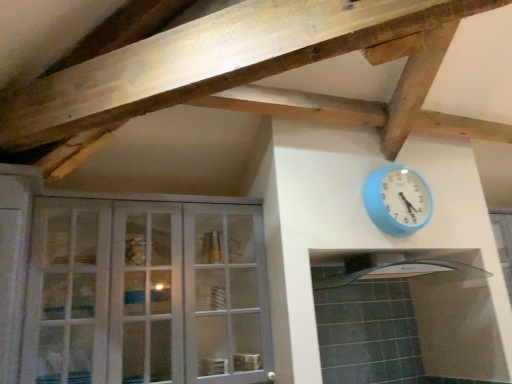
Question: Is white glass cabinet at left surrounding clear glass exhaust hood at center?

Choices:
 (A) yes
 (B) no

Answer: (B)

Question: From a real-world perspective, is white glass cabinet at left located higher than clear glass exhaust hood at center?

Choices:
 (A) yes
 (B) no

Answer: (B)

Question: Does white glass cabinet at left appear on the left side of clear glass exhaust hood at center?

Choices:
 (A) yes
 (B) no

Answer: (A)

Question: Considering the relative sizes of white glass cabinet at left and clear glass exhaust hood at center in the image provided, is white glass cabinet at left shorter than clear glass exhaust hood at center?

Choices:
 (A) no
 (B) yes

Answer: (A)

Question: Does white glass cabinet at left have a greater width compared to clear glass exhaust hood at center?

Choices:
 (A) yes
 (B) no

Answer: (B)

Question: Can you confirm if white glass cabinet at left is smaller than clear glass exhaust hood at center?

Choices:
 (A) yes
 (B) no

Answer: (B)

Question: Does blue plastic wall clock at upper right lie in front of clear glass exhaust hood at center?

Choices:
 (A) no
 (B) yes

Answer: (A)

Question: Can you confirm if blue plastic wall clock at upper right is thinner than clear glass exhaust hood at center?

Choices:
 (A) no
 (B) yes

Answer: (B)

Question: Is blue plastic wall clock at upper right at the left side of clear glass exhaust hood at center?

Choices:
 (A) yes
 (B) no

Answer: (B)

Question: Is blue plastic wall clock at upper right located outside clear glass exhaust hood at center?

Choices:
 (A) no
 (B) yes

Answer: (B)

Question: From a real-world perspective, is blue plastic wall clock at upper right located higher than clear glass exhaust hood at center?

Choices:
 (A) no
 (B) yes

Answer: (B)

Question: From the image's perspective, would you say blue plastic wall clock at upper right is positioned over clear glass exhaust hood at center?

Choices:
 (A) no
 (B) yes

Answer: (B)

Question: From a real-world perspective, is blue plastic wall clock at upper right on white glass cabinet at left?

Choices:
 (A) yes
 (B) no

Answer: (A)